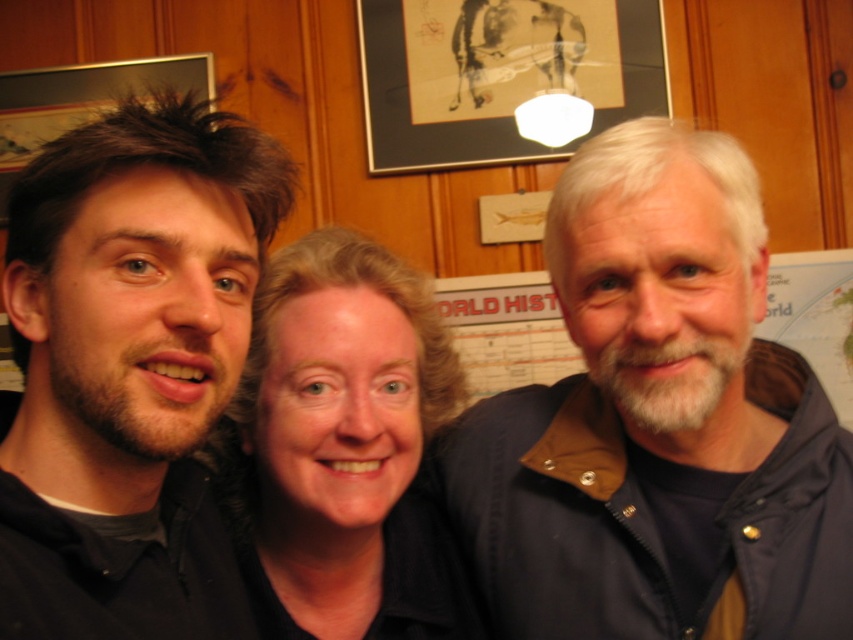
Question: Does black matte shirt at center appear under world map poster at center?

Choices:
 (A) no
 (B) yes

Answer: (B)

Question: Is black matte shirt at center below black matte picture frame at upper center?

Choices:
 (A) yes
 (B) no

Answer: (A)

Question: Which of the following is the closest to the observer?

Choices:
 (A) black matte shirt at center
 (B) black matte picture frame at upper center
 (C) dark brown hair at left
 (D) world map poster at center

Answer: (C)

Question: Which object is closer to the camera taking this photo?

Choices:
 (A) black matte picture frame at upper center
 (B) dark brown hair at left

Answer: (B)

Question: Is dark blue jacket at right bigger than dark brown hair at left?

Choices:
 (A) no
 (B) yes

Answer: (B)

Question: Which of the following is the farthest from the observer?

Choices:
 (A) dark brown hair at left
 (B) black matte shirt at center
 (C) world map poster at center

Answer: (C)